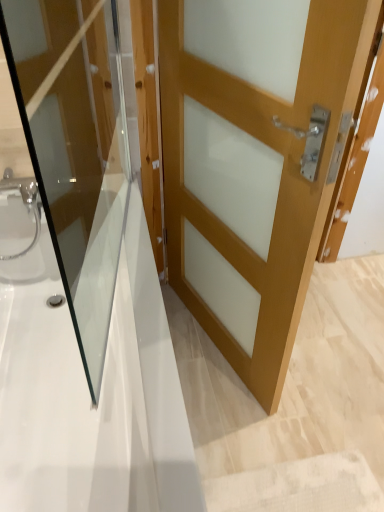
Question: Is matte wood door at center, placed as the first door when sorted from left to right, thinner than light brown wood door at center, which ranks as the 2th door in left-to-right order?

Choices:
 (A) no
 (B) yes

Answer: (B)

Question: Considering the relative sizes of matte wood door at center, placed as the first door when sorted from left to right, and light brown wood door at center, which ranks as the 2th door in left-to-right order, in the image provided, is matte wood door at center, placed as the first door when sorted from left to right, bigger than light brown wood door at center, which ranks as the 2th door in left-to-right order,?

Choices:
 (A) no
 (B) yes

Answer: (A)

Question: From the image's perspective, does matte wood door at center, which appears as the second door when viewed from the right, appear lower than light brown wood door at center, the first door in the right-to-left sequence?

Choices:
 (A) yes
 (B) no

Answer: (B)

Question: Does matte wood door at center, placed as the first door when sorted from left to right, come behind light brown wood door at center, the first door in the right-to-left sequence?

Choices:
 (A) yes
 (B) no

Answer: (B)

Question: Is light brown wood door at center, the first door in the right-to-left sequence, at the back of matte wood door at center, placed as the first door when sorted from left to right?

Choices:
 (A) yes
 (B) no

Answer: (B)

Question: In terms of height, does light brown wood door at center, the first door in the right-to-left sequence, look taller or shorter compared to white glossy bathtub at center?

Choices:
 (A) tall
 (B) short

Answer: (A)

Question: From the image's perspective, is light brown wood door at center, the first door in the right-to-left sequence, positioned above or below white glossy bathtub at center?

Choices:
 (A) above
 (B) below

Answer: (A)

Question: From a real-world perspective, is light brown wood door at center, the first door in the right-to-left sequence, above or below white glossy bathtub at center?

Choices:
 (A) below
 (B) above

Answer: (B)

Question: Is light brown wood door at center, which ranks as the 2th door in left-to-right order, inside the boundaries of white glossy bathtub at center, or outside?

Choices:
 (A) outside
 (B) inside

Answer: (A)

Question: Considering the positions of matte wood door at center, which appears as the second door when viewed from the right, and white glossy bathtub at center in the image, is matte wood door at center, which appears as the second door when viewed from the right, taller or shorter than white glossy bathtub at center?

Choices:
 (A) short
 (B) tall

Answer: (B)

Question: In the image, is matte wood door at center, placed as the first door when sorted from left to right, on the left side or the right side of white glossy bathtub at center?

Choices:
 (A) right
 (B) left

Answer: (A)

Question: From a real-world perspective, is matte wood door at center, placed as the first door when sorted from left to right, positioned above or below white glossy bathtub at center?

Choices:
 (A) above
 (B) below

Answer: (A)

Question: Is matte wood door at center, which appears as the second door when viewed from the right, inside the boundaries of white glossy bathtub at center, or outside?

Choices:
 (A) outside
 (B) inside

Answer: (A)

Question: Is matte wood door at center, placed as the first door when sorted from left to right, bigger or smaller than light brown wood door at center, which ranks as the 2th door in left-to-right order?

Choices:
 (A) big
 (B) small

Answer: (B)

Question: Considering the positions of matte wood door at center, which appears as the second door when viewed from the right, and light brown wood door at center, the first door in the right-to-left sequence, in the image, is matte wood door at center, which appears as the second door when viewed from the right, wider or thinner than light brown wood door at center, the first door in the right-to-left sequence,?

Choices:
 (A) thin
 (B) wide

Answer: (A)